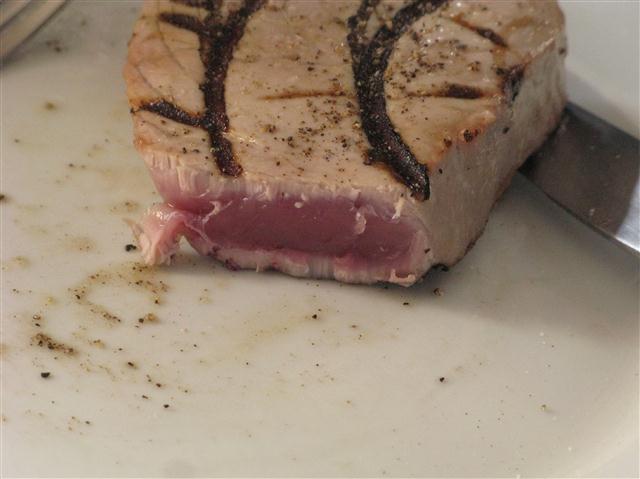
Locate an element on the screen. This screenshot has width=640, height=479. white cutting board is located at coordinates (219, 453).